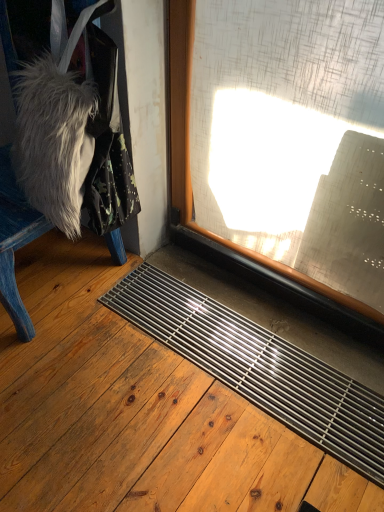
Question: From a real-world perspective, is transparent glass window at center over metallic grid at lower center?

Choices:
 (A) yes
 (B) no

Answer: (A)

Question: Is transparent glass window at center taller than metallic grid at lower center?

Choices:
 (A) no
 (B) yes

Answer: (B)

Question: Is transparent glass window at center at the right side of metallic grid at lower center?

Choices:
 (A) yes
 (B) no

Answer: (A)

Question: From the image's perspective, is transparent glass window at center located above metallic grid at lower center?

Choices:
 (A) no
 (B) yes

Answer: (B)

Question: Is transparent glass window at center touching metallic grid at lower center?

Choices:
 (A) yes
 (B) no

Answer: (B)

Question: From a real-world perspective, is blue painted wood chair at left positioned above or below transparent glass window at center?

Choices:
 (A) below
 (B) above

Answer: (B)

Question: Considering the positions of blue painted wood chair at left and transparent glass window at center in the image, is blue painted wood chair at left taller or shorter than transparent glass window at center?

Choices:
 (A) short
 (B) tall

Answer: (A)

Question: Is blue painted wood chair at left inside or outside of transparent glass window at center?

Choices:
 (A) outside
 (B) inside

Answer: (A)

Question: Considering the positions of blue painted wood chair at left and transparent glass window at center in the image, is blue painted wood chair at left wider or thinner than transparent glass window at center?

Choices:
 (A) thin
 (B) wide

Answer: (B)

Question: In terms of width, does metallic grid at lower center look wider or thinner when compared to transparent glass window at center?

Choices:
 (A) wide
 (B) thin

Answer: (A)

Question: Does point (264, 334) appear closer or farther from the camera than point (192, 6)?

Choices:
 (A) closer
 (B) farther

Answer: (B)

Question: From the image's perspective, is metallic grid at lower center located above or below transparent glass window at center?

Choices:
 (A) below
 (B) above

Answer: (A)

Question: Is metallic grid at lower center inside or outside of transparent glass window at center?

Choices:
 (A) outside
 (B) inside

Answer: (A)

Question: From the image's perspective, is transparent glass window at center located above or below metallic grid at lower center?

Choices:
 (A) above
 (B) below

Answer: (A)

Question: Considering their positions, is transparent glass window at center located in front of or behind metallic grid at lower center?

Choices:
 (A) front
 (B) behind

Answer: (B)